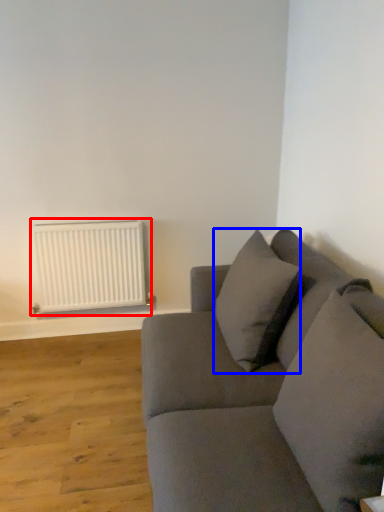
Question: Which object appears closest to the camera in this image, radiator (highlighted by a red box) or pillow (highlighted by a blue box)?

Choices:
 (A) radiator
 (B) pillow

Answer: (B)